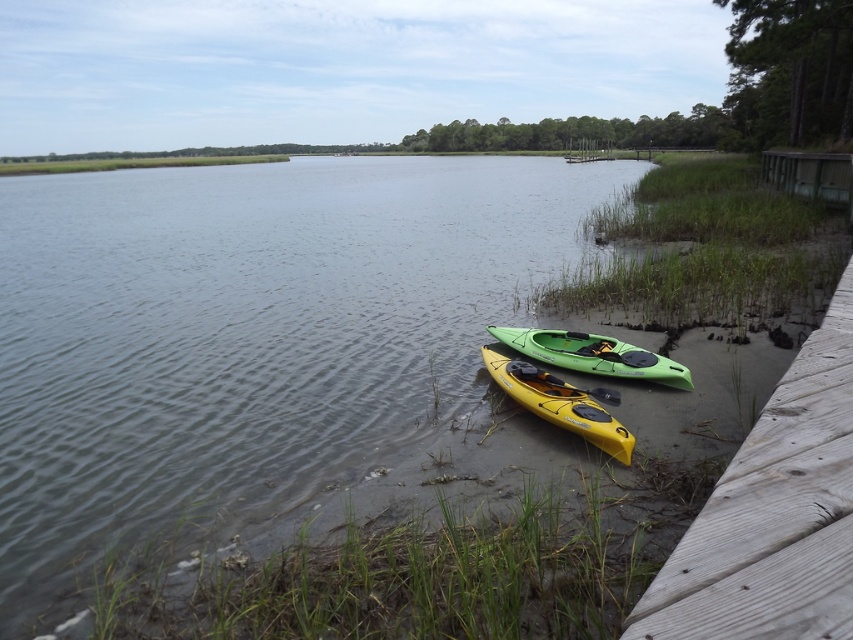
Does green plastic kayak at lower center have a lesser height compared to yellow matte kayak at lower center?

No, green plastic kayak at lower center is not shorter than yellow matte kayak at lower center.

Measure the distance between green plastic kayak at lower center and yellow matte kayak at lower center.

The distance of green plastic kayak at lower center from yellow matte kayak at lower center is 19.30 meters.

You are a GUI agent. You are given a task and a screenshot of the screen. Output one action in this format:
    pyautogui.click(x=<x>, y=<y>)
    Task: Click on the green plastic kayak at lower center
    The image size is (853, 640).
    Given the screenshot: What is the action you would take?
    pyautogui.click(x=247, y=339)

Image resolution: width=853 pixels, height=640 pixels. I want to click on green plastic kayak at lower center, so click(x=247, y=339).

Can you confirm if yellow matte kayak at lower center is positioned to the left of green plastic canoe at lower center?

Yes, yellow matte kayak at lower center is to the left of green plastic canoe at lower center.

Based on the photo, can you confirm if yellow matte kayak at lower center is taller than green plastic canoe at lower center?

Yes.

Locate an element on the screen. This screenshot has height=640, width=853. yellow matte kayak at lower center is located at coordinates (561, 403).

Can you confirm if wooden at lower right is bigger than yellow matte paddle at lower center?

Indeed, wooden at lower right has a larger size compared to yellow matte paddle at lower center.

Looking at this image, between wooden at lower right and yellow matte paddle at lower center, which one has more height?

wooden at lower right is taller.

This screenshot has width=853, height=640. I want to click on wooden at lower right, so click(x=773, y=515).